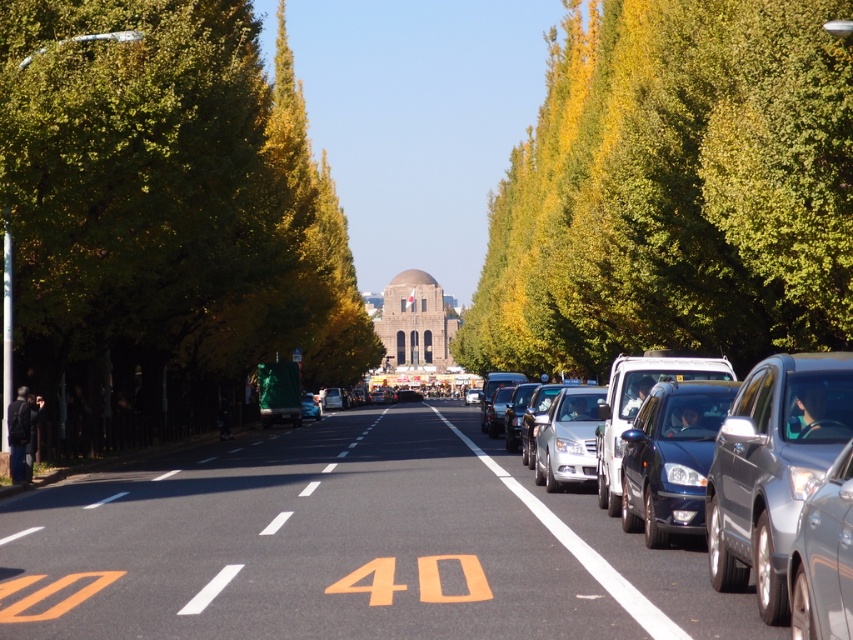
You are driving a car and approaching the large domed structure. You notice a green leafy tree at left and a sleek silver sedan at right. Which object is positioned more to the east if the avenue runs north to south?

The green leafy tree at left is positioned more to the east because it is to the left of the sleek silver sedan at right, and since the avenue runs north to south, the left side would be east.

You are driving a car and see the green leafy tree at left and the shiny blue sedan at right. Which object is taller?

The green leafy tree at left is much taller than the shiny blue sedan at right.